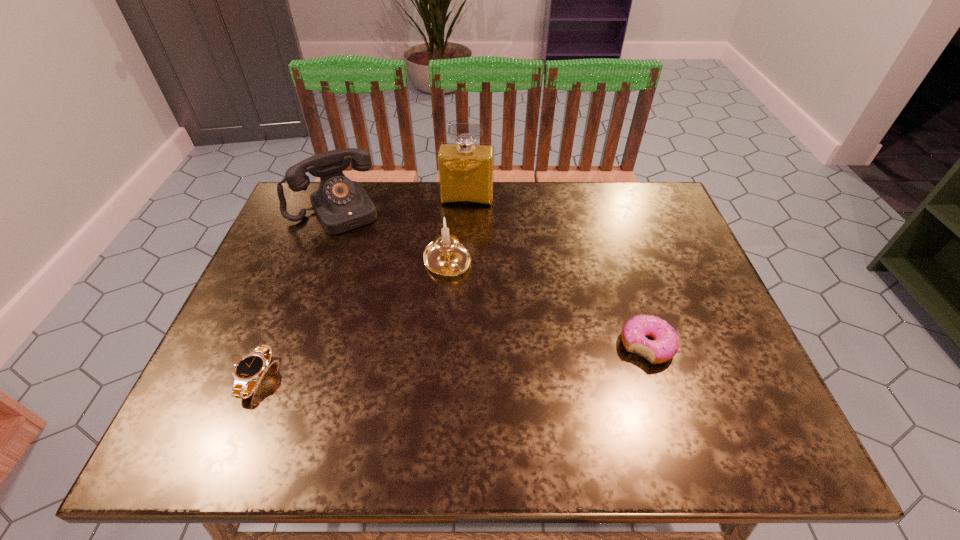
The width and height of the screenshot is (960, 540). I want to click on vacant space located 0.330m on the handle side of the third nearest object, so coord(527,386).

This screenshot has height=540, width=960. I want to click on blank area located on the front-facing side of the perfume, so click(x=455, y=288).

Locate an element on the screen. free location located on the front-facing side of the perfume is located at coordinates (457, 271).

You are a GUI agent. You are given a task and a screenshot of the screen. Output one action in this format:
    pyautogui.click(x=<x>, y=<y>)
    Task: Click on the vacant space located 0.190m on the front-facing side of the perfume
    The width and height of the screenshot is (960, 540).
    Given the screenshot: What is the action you would take?
    pyautogui.click(x=460, y=250)

Identify the location of blank area located 0.380m on the dial of the telephone. This screenshot has width=960, height=540. (405, 323).

The height and width of the screenshot is (540, 960). In order to click on free spot located 0.110m on the dial of the telephone in this screenshot , I will do `click(364, 254)`.

Find the location of a particular element. This screenshot has height=540, width=960. vacant space located on the dial of the telephone is located at coordinates (371, 266).

Locate an element on the screen. perfume positioned at the far edge is located at coordinates (465, 169).

This screenshot has height=540, width=960. Identify the location of telephone at the far edge. (340, 204).

You are a GUI agent. You are given a task and a screenshot of the screen. Output one action in this format:
    pyautogui.click(x=<x>, y=<y>)
    Task: Click on the object that is at the near edge
    
    Given the screenshot: What is the action you would take?
    pyautogui.click(x=250, y=368)